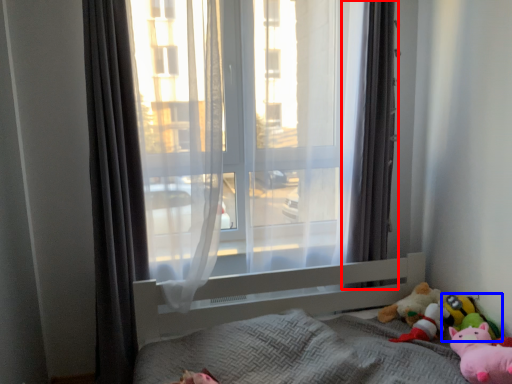
Question: Which of the following is the closest to the observer, curtain (highlighted by a red box) or toy (highlighted by a blue box)?

Choices:
 (A) curtain
 (B) toy

Answer: (B)